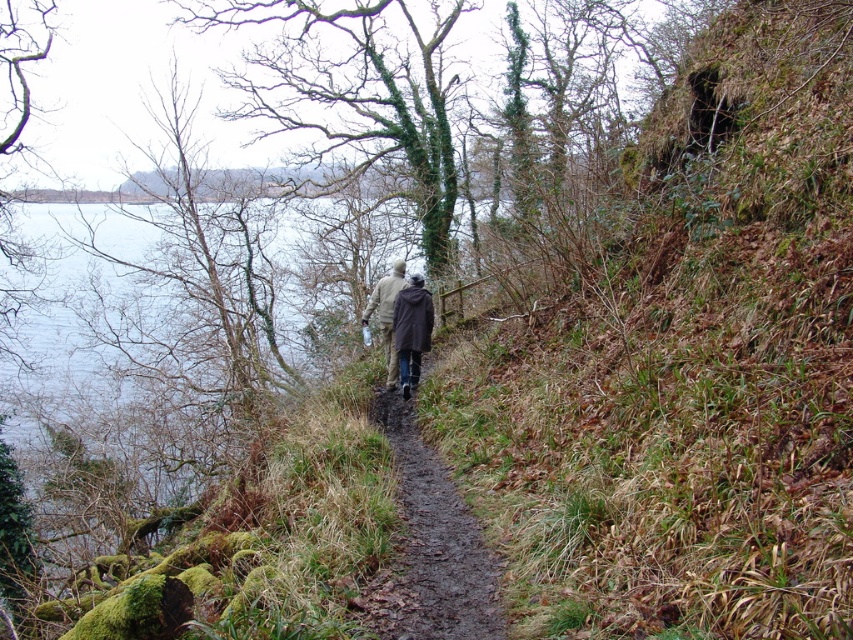
Who is shorter, brown dirt path at center or dark brown leather jacket at center?

Answer: With less height is brown dirt path at center.

In the scene shown: Is brown dirt path at center taller than dark brown leather jacket at center?

Incorrect, brown dirt path at center's height is not larger of dark brown leather jacket at center's.

Describe the element at coordinates (428, 548) in the screenshot. I see `brown dirt path at center` at that location.

Find the location of a particular element. This screenshot has width=853, height=640. brown dirt path at center is located at coordinates (428, 548).

Is dark brown leather jacket at center to the left of camouflage jacket at center from the viewer's perspective?

In fact, dark brown leather jacket at center is to the right of camouflage jacket at center.

Is point (393, 330) closer to camera compared to point (386, 384)?

That is True.

In the scene shown: Who is more distant from viewer, (415, 301) or (395, 266)?

The point (395, 266) is more distant.

This screenshot has height=640, width=853. I want to click on dark brown leather jacket at center, so click(410, 330).

Is brown dirt path at center further to camera compared to camouflage jacket at center?

No, brown dirt path at center is in front of camouflage jacket at center.

Is point (431, 493) less distant than point (386, 294)?

Yes, point (431, 493) is closer to viewer.

You are a GUI agent. You are given a task and a screenshot of the screen. Output one action in this format:
    pyautogui.click(x=<x>, y=<y>)
    Task: Click on the brown dirt path at center
    
    Given the screenshot: What is the action you would take?
    pyautogui.click(x=428, y=548)